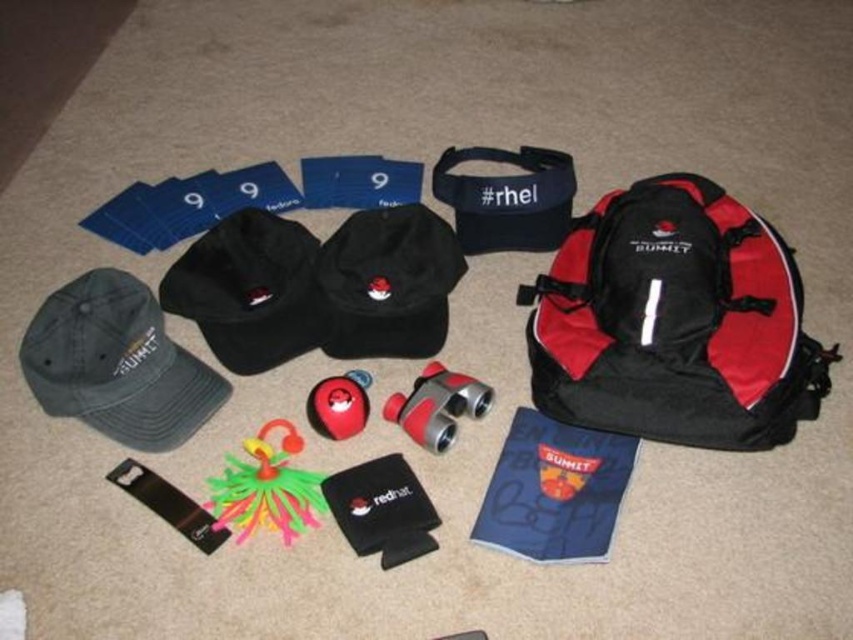
What do you see at coordinates (674, 321) in the screenshot?
I see `red/black nylon backpack at center-right` at bounding box center [674, 321].

Who is positioned more to the right, red/black nylon backpack at center-right or black fabric baseball cap at center?

red/black nylon backpack at center-right

Is point (776, 358) positioned before point (344, 326)?

Yes, it is.

This screenshot has height=640, width=853. In order to click on red/black nylon backpack at center-right in this screenshot , I will do pos(674,321).

This screenshot has height=640, width=853. In order to click on black fabric baseball cap at center in this screenshot , I will do `click(387, 284)`.

Consider the image. Is black fabric baseball cap at center positioned before rubber/soft toy at center?

No, black fabric baseball cap at center is behind rubber/soft toy at center.

Which is in front, point (425, 310) or point (357, 392)?

Point (357, 392) is in front.

Identify the location of black fabric baseball cap at center. (387, 284).

Can you confirm if black fabric baseball cap at upper left is positioned to the left of rubber duck at center?

Indeed, black fabric baseball cap at upper left is positioned on the left side of rubber duck at center.

Can you confirm if black fabric baseball cap at upper left is positioned to the right of rubber duck at center?

Incorrect, black fabric baseball cap at upper left is not on the right side of rubber duck at center.

Is point (252, 326) closer to viewer compared to point (248, 468)?

That is False.

The width and height of the screenshot is (853, 640). I want to click on black fabric baseball cap at upper left, so point(248,291).